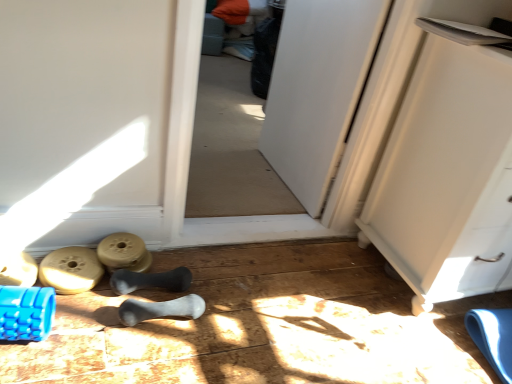
Question: In which direction should I rotate to look at gray rubber bone at center, arranged as the first footwear when viewed from the right?

Choices:
 (A) right
 (B) left

Answer: (B)

Question: Can gray rubber bone at center, which is the 3th footwear in left-to-right order, be found inside gray rubber bone at center, arranged as the 4th footwear when viewed from the left?

Choices:
 (A) yes
 (B) no

Answer: (B)

Question: Considering the relative sizes of gray rubber bone at center, arranged as the first footwear when viewed from the right, and gray rubber bone at center, which is the 3th footwear in left-to-right order, in the image provided, is gray rubber bone at center, arranged as the first footwear when viewed from the right, taller than gray rubber bone at center, which is the 3th footwear in left-to-right order,?

Choices:
 (A) yes
 (B) no

Answer: (B)

Question: Does gray rubber bone at center, arranged as the first footwear when viewed from the right, have a greater width compared to gray rubber bone at center, positioned as the 2th footwear in right-to-left order?

Choices:
 (A) no
 (B) yes

Answer: (B)

Question: Are gray rubber bone at center, arranged as the 4th footwear when viewed from the left, and gray rubber bone at center, positioned as the 2th footwear in right-to-left order, beside each other?

Choices:
 (A) yes
 (B) no

Answer: (A)

Question: Is gray rubber bone at center, arranged as the 4th footwear when viewed from the left, behind gray rubber bone at center, positioned as the 2th footwear in right-to-left order?

Choices:
 (A) no
 (B) yes

Answer: (A)

Question: Is gray rubber bone at center, arranged as the 4th footwear when viewed from the left, closer to the viewer compared to gray rubber bone at center, which is the 3th footwear in left-to-right order?

Choices:
 (A) no
 (B) yes

Answer: (B)

Question: Is white matte cabinet at right in contact with blue textured foam roller at lower left, acting as the second job starting from the back?

Choices:
 (A) yes
 (B) no

Answer: (B)

Question: Is white matte cabinet at right further to the viewer compared to blue textured foam roller at lower left, the 1th job from the left?

Choices:
 (A) yes
 (B) no

Answer: (A)

Question: From a real-world perspective, is white matte cabinet at right under blue textured foam roller at lower left, marked as the 1th job in a front-to-back arrangement?

Choices:
 (A) yes
 (B) no

Answer: (B)

Question: Is white matte cabinet at right aimed at blue textured foam roller at lower left, acting as the second job starting from the back?

Choices:
 (A) yes
 (B) no

Answer: (B)

Question: From the image's perspective, would you say white matte cabinet at right is positioned over blue textured foam roller at lower left, marked as the 1th job in a front-to-back arrangement?

Choices:
 (A) yes
 (B) no

Answer: (A)

Question: Does white matte cabinet at right have a lesser width compared to blue textured foam roller at lower left, marked as the 1th job in a front-to-back arrangement?

Choices:
 (A) no
 (B) yes

Answer: (A)

Question: Is gray rubber bone at center, which is the 3th footwear in left-to-right order, bigger than white matte cabinet at right?

Choices:
 (A) yes
 (B) no

Answer: (B)